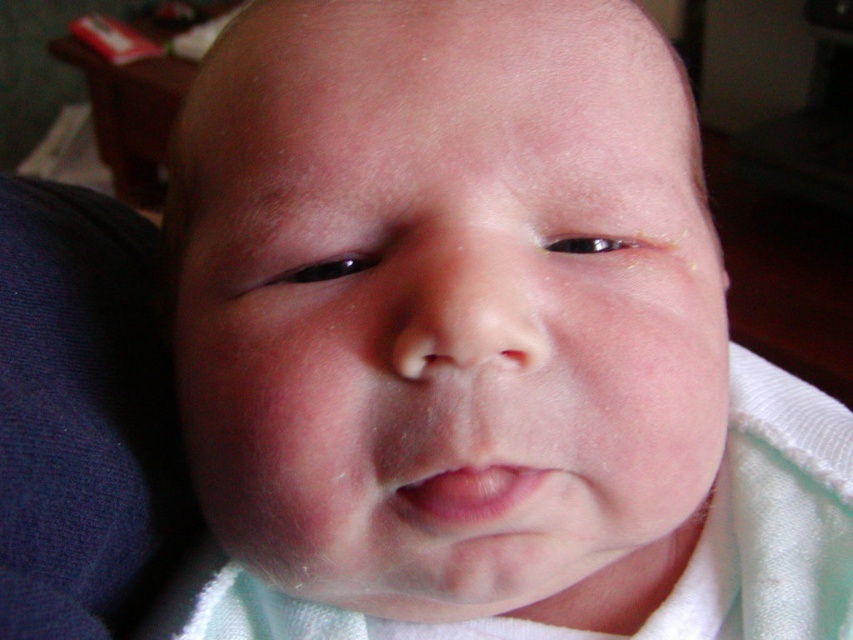
You are a pediatrician examining a newborn. You notice the smooth skin baby at center and the pink smooth lips at center. Which part of the baby should you focus on more during your examination, the larger area or the smaller one?

The smooth skin baby at center is bigger than the pink smooth lips at center, so you should focus more on the smooth skin baby at center during the examination.

Consider the image. Looking at the baby in the image, which part is taller between the smooth skin baby at center and the pink smooth lips at center?

The smooth skin baby at center is much taller than the pink smooth lips at center.